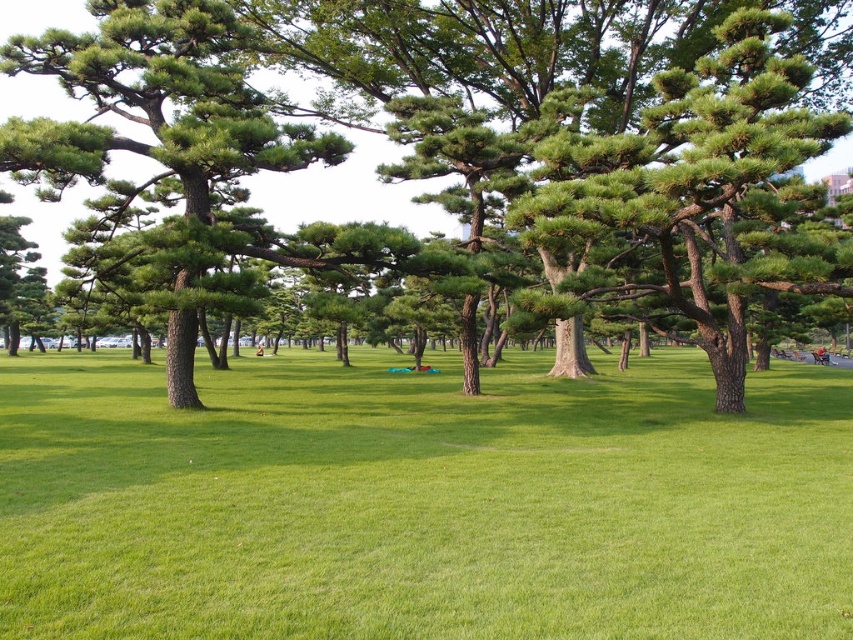
Question: Can you confirm if green textured tree at center is positioned to the left of green matte tree at center?

Choices:
 (A) yes
 (B) no

Answer: (B)

Question: Which of the following is the farthest from the observer?

Choices:
 (A) green grassy field at center
 (B) green matte tree at center
 (C) green textured tree at center

Answer: (B)

Question: Among these points, which one is nearest to the camera?

Choices:
 (A) (433, 33)
 (B) (792, 528)
 (C) (53, 60)

Answer: (B)

Question: Among these objects, which one is farthest from the camera?

Choices:
 (A) green matte tree at center
 (B) green grassy field at center
 (C) green textured tree at center

Answer: (A)

Question: Can you confirm if green grassy field at center is positioned below green matte tree at center?

Choices:
 (A) no
 (B) yes

Answer: (B)

Question: Is the position of green grassy field at center more distant than that of green textured tree at center?

Choices:
 (A) yes
 (B) no

Answer: (B)